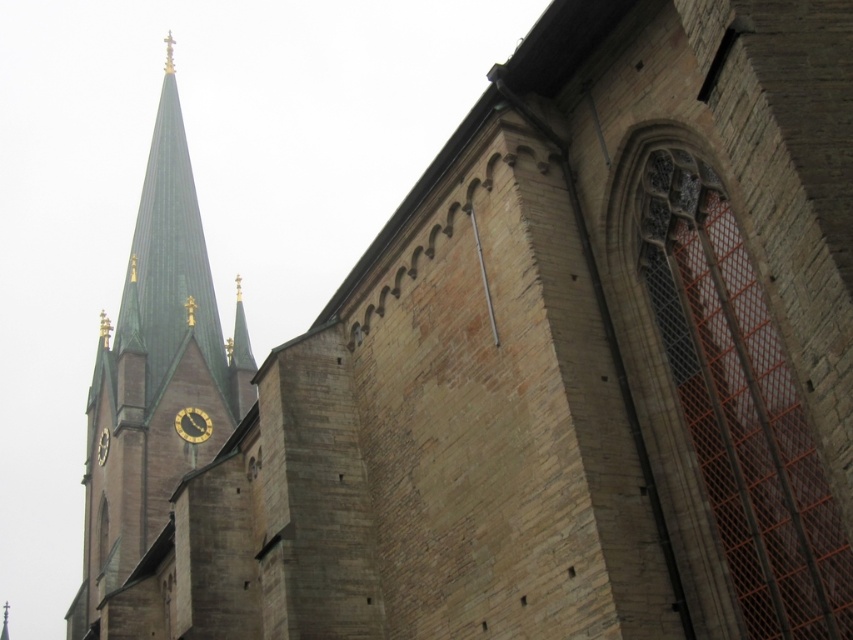
You are standing at a point 138 meters away from the point marked at coordinates (160, 176) on the church facade. If you want to take a photo of the spire with the golden cross, will you be able to capture it in your shot?

Yes, since you are 138 meters away from the point marked at coordinates (160, 176) on the church facade, which is part of the spire, you can capture the spire with the golden cross in your photo.